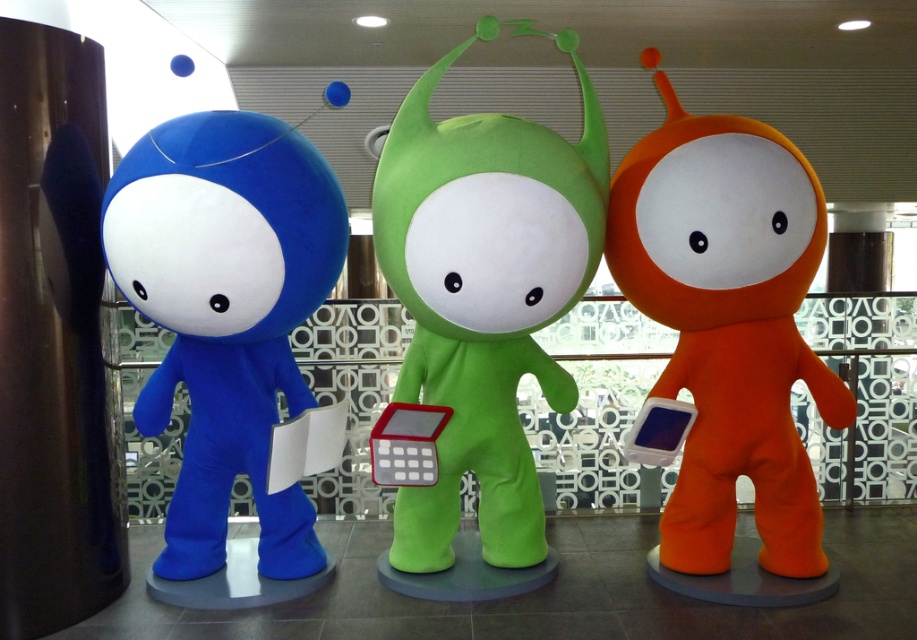
Does green plush toy at center have a larger size compared to matte blue plush toy at left?

Correct, green plush toy at center is larger in size than matte blue plush toy at left.

Is green plush toy at center taller than matte blue plush toy at left?

Yes.

What do you see at coordinates (484, 296) in the screenshot? I see `green plush toy at center` at bounding box center [484, 296].

Where is `green plush toy at center`? This screenshot has height=640, width=917. green plush toy at center is located at coordinates (484, 296).

Based on the photo, measure the distance between point (564, 221) and camera.

3.06 meters

Who is more distant from viewer, [439,262] or [755,195]?

Positioned behind is point [755,195].

Does point (496, 122) come behind point (804, 566)?

No, (496, 122) is closer to viewer.

Where is `green plush toy at center`? The height and width of the screenshot is (640, 917). green plush toy at center is located at coordinates (484, 296).

Who is higher up, matte blue plush toy at left or orange soft plush toy at right?

orange soft plush toy at right is higher up.

Measure the distance between matte blue plush toy at left and camera.

The distance of matte blue plush toy at left from camera is 2.91 meters.

Is point (145, 163) positioned in front of point (711, 240)?

Yes, point (145, 163) is in front of point (711, 240).

Locate an element on the screen. This screenshot has width=917, height=640. matte blue plush toy at left is located at coordinates (226, 314).